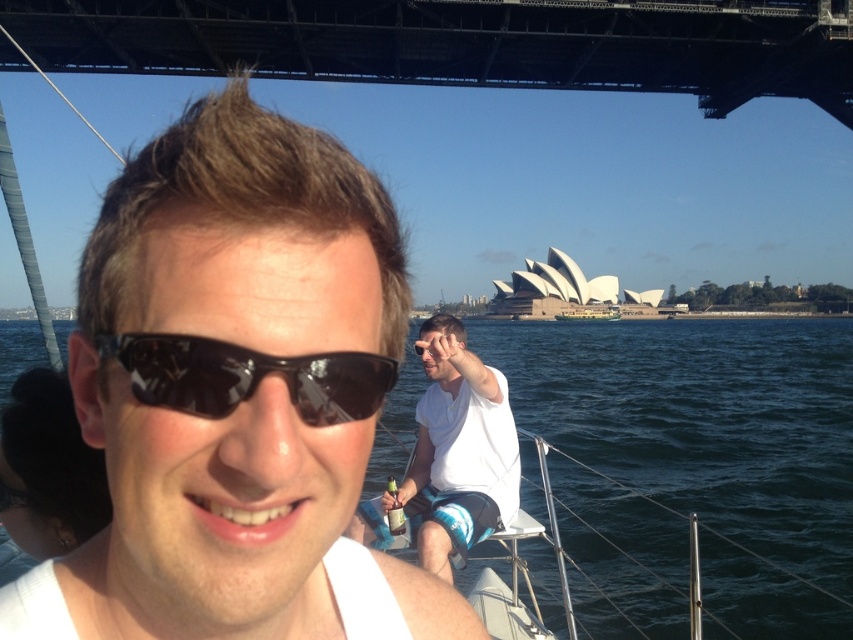
You are a photographer trying to capture the matte black sunglasses at center and the black reflective sunglasses at center in a photo. Which sunglasses are located below the other?

The matte black sunglasses at center is positioned under the black reflective sunglasses at center, so the matte black sunglasses at center are below the black reflective sunglasses at center.

You are a photographer trying to capture the reflection of the white cotton shirt at center in the dark blue water at center. Based on their relative heights, will the reflection be visible in the water?

The dark blue water at center has a greater height compared to white cotton shirt at center. Since the water is higher than the shirt, the reflection would not be visible because the shirt is below the water surface.